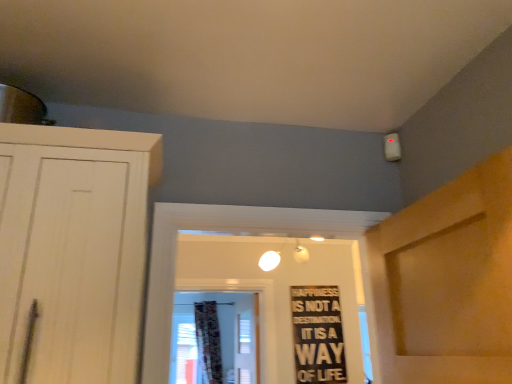
Question: In terms of height, does black matte signboard at center look taller or shorter compared to floral fabric curtain at center?

Choices:
 (A) short
 (B) tall

Answer: (A)

Question: In terms of size, does black matte signboard at center appear bigger or smaller than floral fabric curtain at center?

Choices:
 (A) big
 (B) small

Answer: (B)

Question: From the image's perspective, is black matte signboard at center above or below floral fabric curtain at center?

Choices:
 (A) below
 (B) above

Answer: (B)

Question: Which is correct: floral fabric curtain at center is inside black matte signboard at center, or outside of it?

Choices:
 (A) outside
 (B) inside

Answer: (A)

Question: Is floral fabric curtain at center bigger or smaller than black matte signboard at center?

Choices:
 (A) big
 (B) small

Answer: (A)

Question: In terms of width, does floral fabric curtain at center look wider or thinner when compared to black matte signboard at center?

Choices:
 (A) thin
 (B) wide

Answer: (B)

Question: From the image's perspective, is floral fabric curtain at center located above or below black matte signboard at center?

Choices:
 (A) above
 (B) below

Answer: (B)